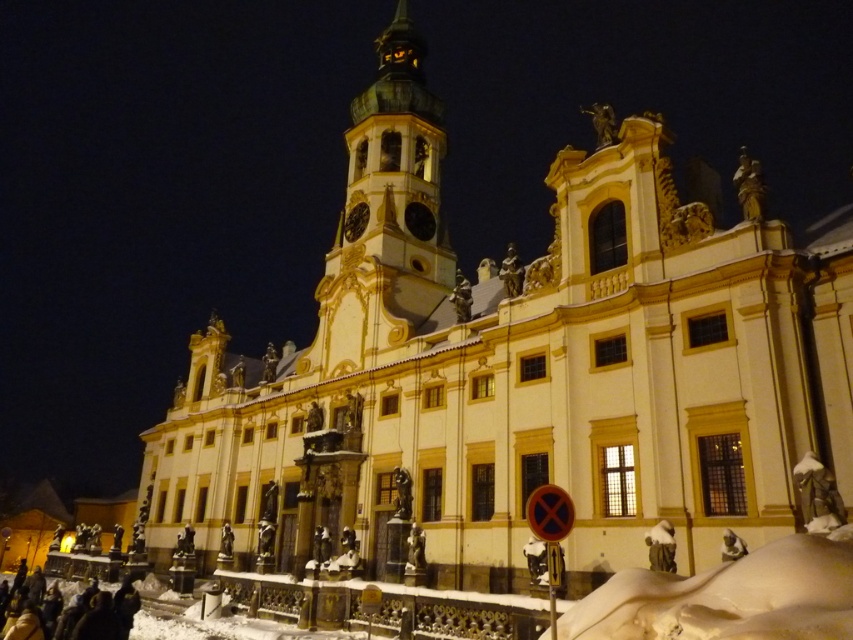
You are standing in front of the building and see the white fluffy snow at lower right and the dark brown leather coat at lower left. Which object is taller?

The dark brown leather coat at lower left is taller than the white fluffy snow at lower right.